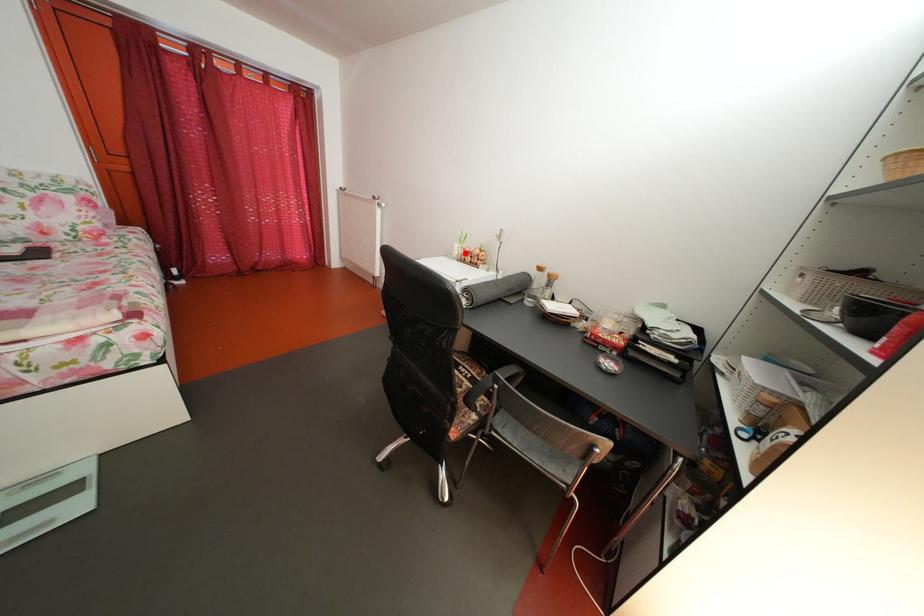
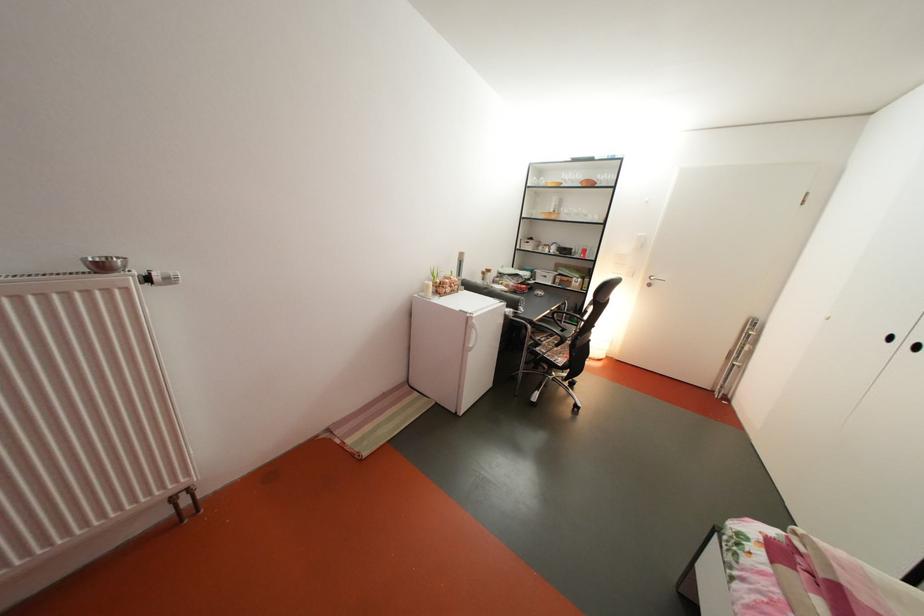
In the second image, find the point that corresponds to the highlighted location in the first image.

(439, 293)